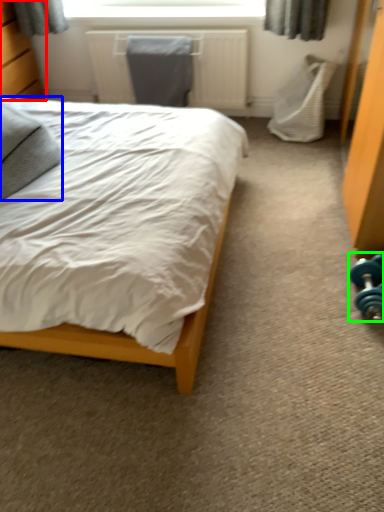
Question: Which object is positioned farthest from dresser (highlighted by a red box)? Select from pillow (highlighted by a blue box) and dumbbell (highlighted by a green box).

Choices:
 (A) pillow
 (B) dumbbell

Answer: (B)